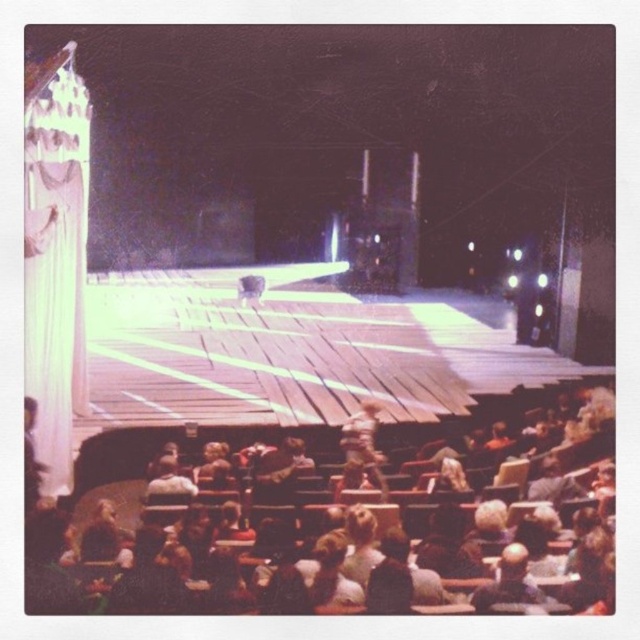
Based on the photo, you are an usher who needs to place a new wooden chair at lower center in the theater. The existing wooden figure at center is already on stage. Which object is taller so you can decide where to place the new chair appropriately?

The wooden figure at center is taller than the wooden chair at lower center, so you should place the new chair at lower center where it won

You are sitting in the wooden chair at lower center. Looking towards the stage, can you see the large, draped curtain on the left side of the stage?

Yes, the large, draped curtain on the left side of the stage is visible from the wooden chair at lower center because the chair is positioned at point (304, 518), which allows a clear line of sight to the stage area.